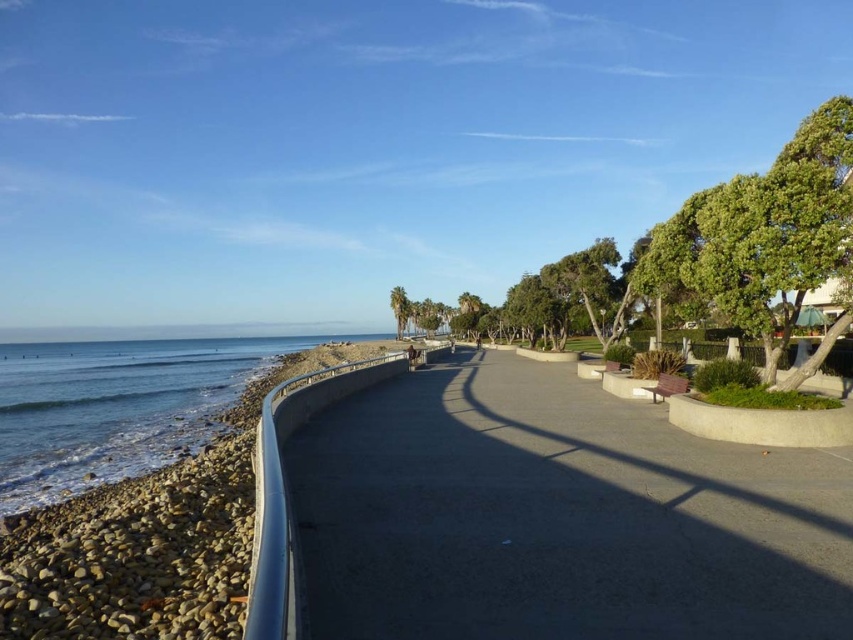
Question: Which of the following is the closest to the observer?

Choices:
 (A) blue smooth water at lower left
 (B) gray concrete pavement at center

Answer: (B)

Question: Is gray concrete pavement at center to the left of blue smooth water at lower left from the viewer's perspective?

Choices:
 (A) yes
 (B) no

Answer: (B)

Question: Is gray concrete pavement at center wider than blue smooth water at lower left?

Choices:
 (A) no
 (B) yes

Answer: (A)

Question: Observing the image, what is the correct spatial positioning of gray concrete pavement at center in reference to blue smooth water at lower left?

Choices:
 (A) left
 (B) right

Answer: (B)

Question: Which object appears farthest from the camera in this image?

Choices:
 (A) gray concrete pavement at center
 (B) blue smooth water at lower left

Answer: (B)